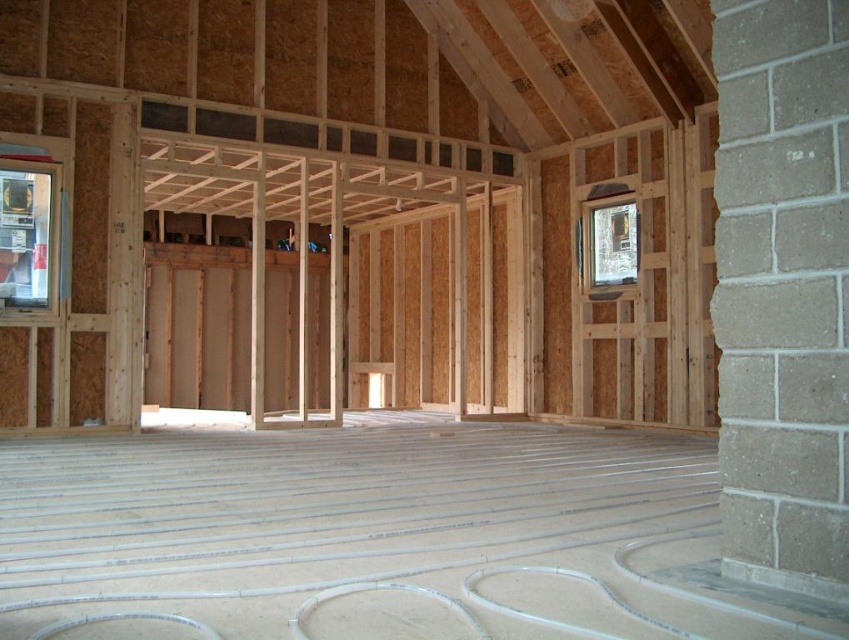
You are standing in the center of the construction site and need to locate the clear glass window at left. According to the coordinates given, where should you look relative to your position?

The clear glass window at left is located at coordinates point (25, 236), which means it is positioned to the left and slightly forward from your central position in the construction site.

You are a construction worker standing at point (x=25, y=236) in the building. You need to check the progress of the window installation. Is there a window at your current location?

Yes, there is a clear glass window at left located at point (x=25, y=236).